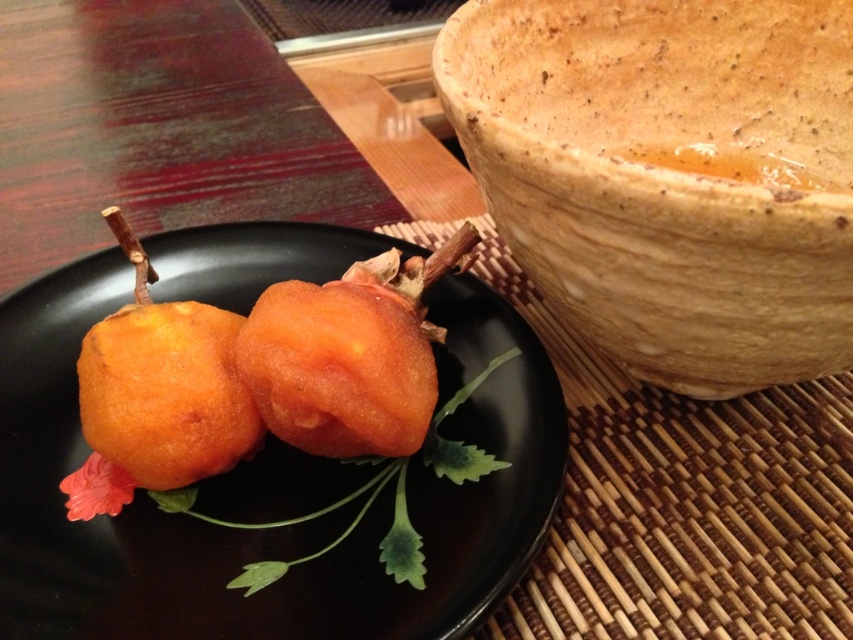
Question: Can you confirm if orange matte/powdery fruit at center is positioned above golden fried donut at center?

Choices:
 (A) no
 (B) yes

Answer: (A)

Question: Does orange matte fruit at center have a smaller size compared to golden fried donut at center?

Choices:
 (A) yes
 (B) no

Answer: (B)

Question: Which object is the farthest from the golden fried donut at center?

Choices:
 (A) orange matte/powdery fruit at center
 (B) orange matte fruit at center
 (C) speckled clay bowl at upper right

Answer: (C)

Question: Is speckled clay bowl at upper right to the left of golden fried donut at center from the viewer's perspective?

Choices:
 (A) no
 (B) yes

Answer: (A)

Question: Which point appears farthest from the camera in this image?

Choices:
 (A) (260, 404)
 (B) (113, 388)
 (C) (764, 305)

Answer: (A)

Question: Which of the following is the farthest from the observer?

Choices:
 (A) (234, 324)
 (B) (804, 84)

Answer: (B)